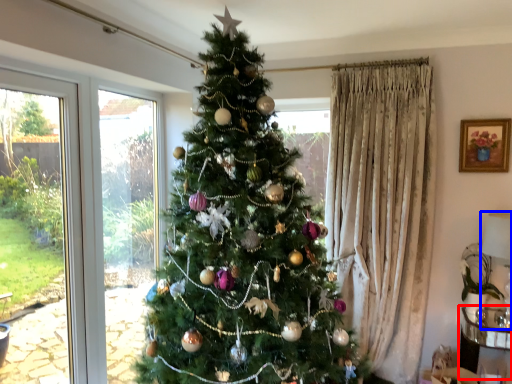
Question: Which of the following is the farthest to the observer, furniture (highlighted by a red box) or lamp (highlighted by a blue box)?

Choices:
 (A) furniture
 (B) lamp

Answer: (A)